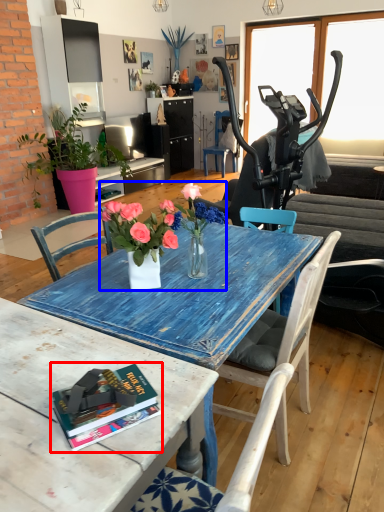
Question: Which object is further to the camera taking this photo, book (highlighted by a red box) or floral arrangement (highlighted by a blue box)?

Choices:
 (A) book
 (B) floral arrangement

Answer: (B)